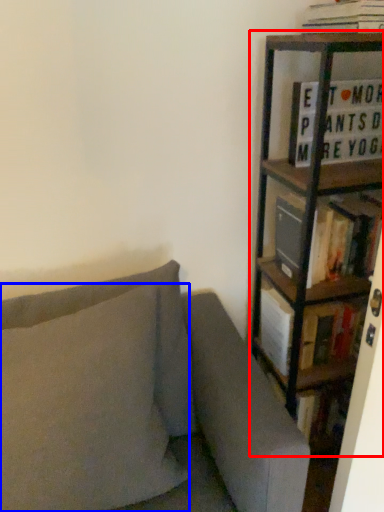
Question: Which object appears closest to the camera in this image, bookcase (highlighted by a red box) or pillow (highlighted by a blue box)?

Choices:
 (A) bookcase
 (B) pillow

Answer: (B)